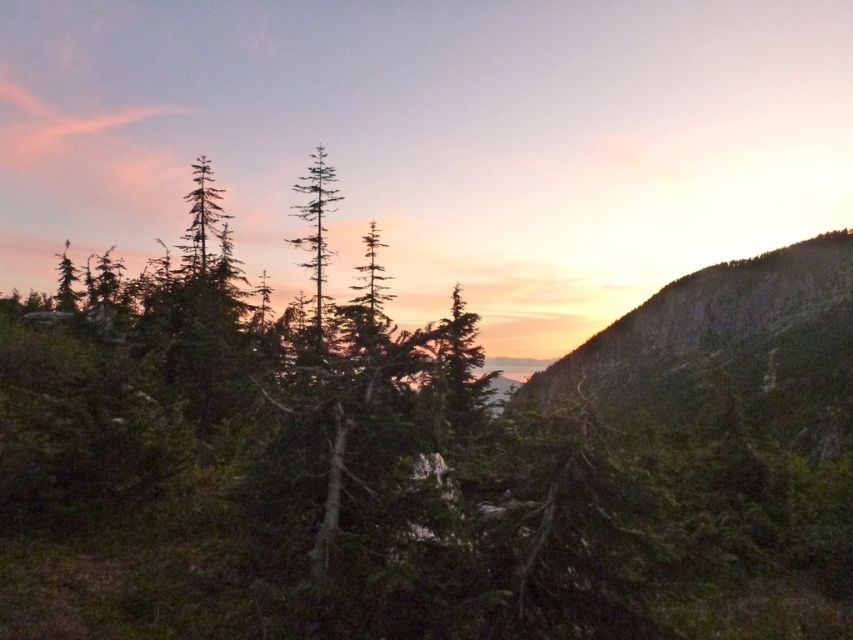
Question: Can you confirm if green textured rock at right is positioned to the right of green matte tree at center?

Choices:
 (A) no
 (B) yes

Answer: (B)

Question: Which object is closer to the camera taking this photo?

Choices:
 (A) green matte tree at center
 (B) green textured rock at right

Answer: (B)

Question: Can you confirm if green textured rock at right is smaller than green matte tree at center?

Choices:
 (A) yes
 (B) no

Answer: (B)

Question: Does green textured rock at right have a lesser width compared to green matte tree at center?

Choices:
 (A) no
 (B) yes

Answer: (A)